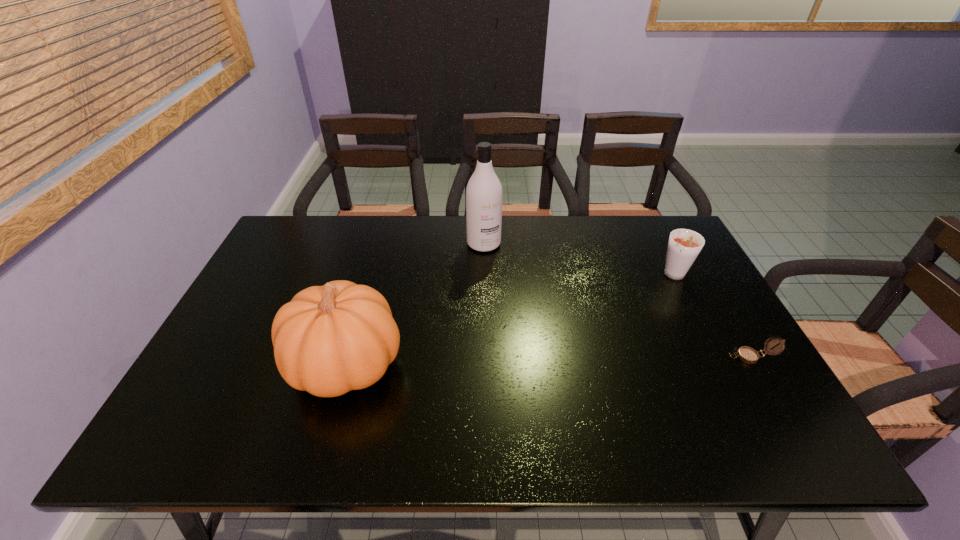
The image size is (960, 540). Identify the location of free space on the desktop that is between the pumpkin and the compass and is positioned on the drink side of the second farthest object. (587, 360).

Identify the location of vacant spot on the desktop that is between the leftmost object and the shortest object and is positioned on the front-facing side of the third object from right to left. (546, 361).